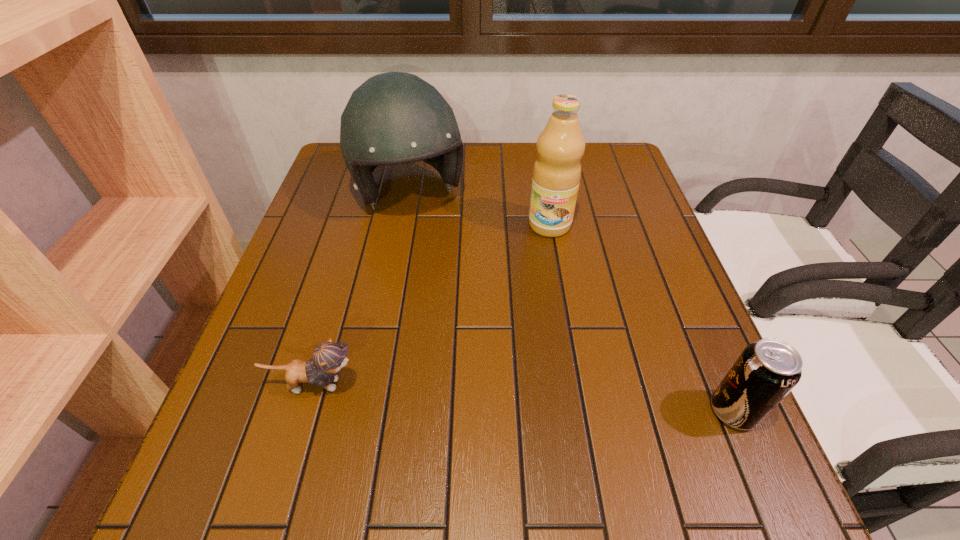
At what (x,y) coordinates should I click in order to perform the action: click on vacant space located 0.320m on the label of the olive oil. Please return your answer as a coordinate pair (x, y). Looking at the image, I should click on (531, 342).

The height and width of the screenshot is (540, 960). Find the location of `blank space located on the label of the olive oil`. blank space located on the label of the olive oil is located at coordinates (535, 315).

I want to click on free region located 0.310m on the label of the olive oil, so click(531, 338).

The height and width of the screenshot is (540, 960). I want to click on object situated at the far edge, so click(x=393, y=118).

You are a GUI agent. You are given a task and a screenshot of the screen. Output one action in this format:
    pyautogui.click(x=<x>, y=<y>)
    Task: Click on the kitten situated at the near edge
    The image size is (960, 540).
    Given the screenshot: What is the action you would take?
    pyautogui.click(x=328, y=358)

At what (x,y) coordinates should I click in order to perform the action: click on soda can that is at the near edge. Please return your answer as a coordinate pair (x, y). This screenshot has width=960, height=540. Looking at the image, I should click on point(766,371).

Locate an element on the screen. The width and height of the screenshot is (960, 540). kitten that is at the left edge is located at coordinates (328, 358).

This screenshot has width=960, height=540. Identify the location of football helmet at the left edge. (393, 118).

You are a GUI agent. You are given a task and a screenshot of the screen. Output one action in this format:
    pyautogui.click(x=<x>, y=<y>)
    Task: Click on the object located at the right edge
    The width and height of the screenshot is (960, 540).
    Given the screenshot: What is the action you would take?
    pyautogui.click(x=766, y=371)

Locate an element on the screen. The width and height of the screenshot is (960, 540). object that is positioned at the far left corner is located at coordinates (393, 118).